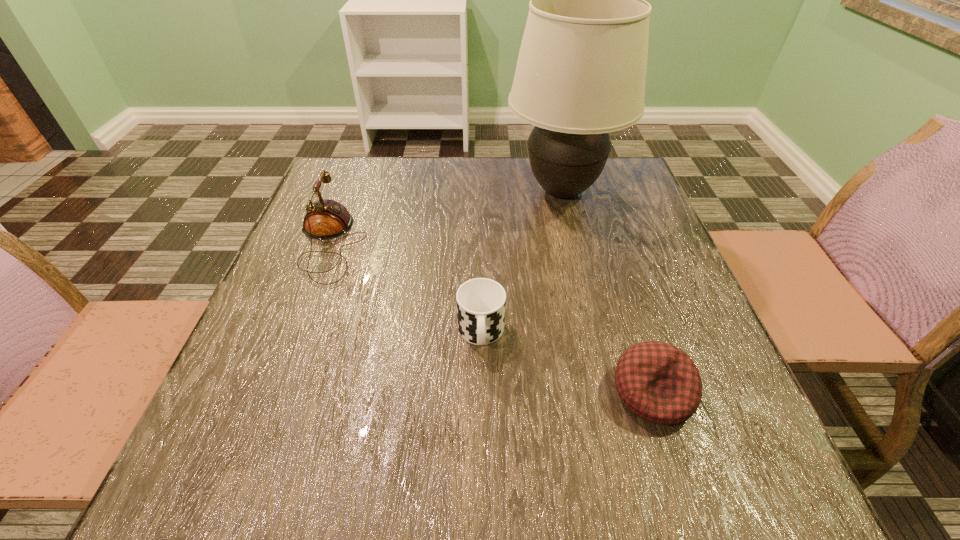
Where is `object at the left edge`? object at the left edge is located at coordinates (325, 219).

Find the location of a particular element. This screenshot has width=960, height=540. lampshade situated at the right edge is located at coordinates (581, 71).

The width and height of the screenshot is (960, 540). I want to click on beanbag located in the right edge section of the desktop, so click(x=658, y=382).

The width and height of the screenshot is (960, 540). Find the location of `object that is at the far right corner`. object that is at the far right corner is located at coordinates (581, 71).

At what (x,y) coordinates should I click in order to perform the action: click on vacant space at the far edge of the desktop. Please return your answer as a coordinate pair (x, y). This screenshot has height=540, width=960. Looking at the image, I should click on (396, 184).

Where is `vacant space at the near edge of the desktop`? The image size is (960, 540). vacant space at the near edge of the desktop is located at coordinates (652, 444).

Where is `vacant space at the left edge`? vacant space at the left edge is located at coordinates (240, 382).

The image size is (960, 540). In the image, there is a desktop. Identify the location of vacant region at the right edge. (625, 296).

You are a GUI agent. You are given a task and a screenshot of the screen. Output one action in this format:
    pyautogui.click(x=<x>, y=<y>)
    Task: Click on the vacant area at the near right corner of the desktop
    
    Given the screenshot: What is the action you would take?
    pyautogui.click(x=740, y=455)

Locate an element on the screen. This screenshot has width=960, height=540. free space that is in between the lampshade and the leftmost object is located at coordinates (446, 217).